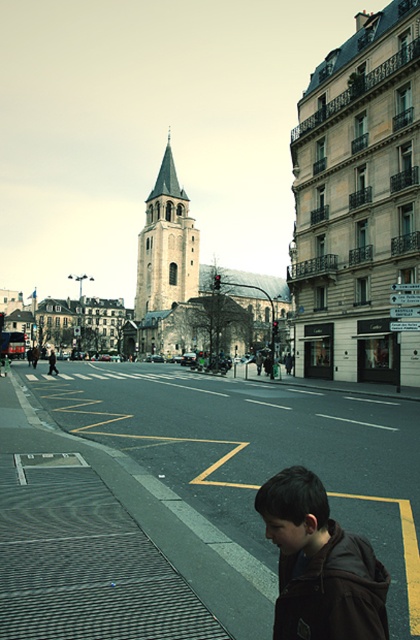
Question: Is brown leather jacket at lower right wider than stone steeple at center?

Choices:
 (A) no
 (B) yes

Answer: (A)

Question: Which point is farther to the camera?

Choices:
 (A) stone steeple at center
 (B) brown leather jacket at lower right

Answer: (A)

Question: Which of the following is the farthest from the observer?

Choices:
 (A) (273, 497)
 (B) (173, 256)

Answer: (B)

Question: Does brown leather jacket at lower right have a lesser width compared to stone steeple at center?

Choices:
 (A) no
 (B) yes

Answer: (B)

Question: Is brown leather jacket at lower right to the right of stone steeple at center from the viewer's perspective?

Choices:
 (A) yes
 (B) no

Answer: (A)